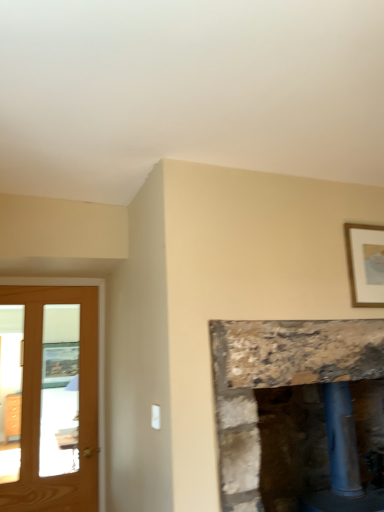
Question: From a real-world perspective, does gold wooden picture frame at upper right stand above rustic stone fireplace at center?

Choices:
 (A) yes
 (B) no

Answer: (A)

Question: From a real-world perspective, is gold wooden picture frame at upper right below rustic stone fireplace at center?

Choices:
 (A) no
 (B) yes

Answer: (A)

Question: Considering the relative positions of gold wooden picture frame at upper right and rustic stone fireplace at center in the image provided, is gold wooden picture frame at upper right to the left of rustic stone fireplace at center from the viewer's perspective?

Choices:
 (A) no
 (B) yes

Answer: (B)

Question: Can you confirm if gold wooden picture frame at upper right is bigger than rustic stone fireplace at center?

Choices:
 (A) no
 (B) yes

Answer: (A)

Question: Does gold wooden picture frame at upper right have a smaller size compared to rustic stone fireplace at center?

Choices:
 (A) no
 (B) yes

Answer: (B)

Question: Is gold wooden picture frame at upper right bigger or smaller than rustic stone fireplace at center?

Choices:
 (A) small
 (B) big

Answer: (A)

Question: Choose the correct answer: Is gold wooden picture frame at upper right inside rustic stone fireplace at center or outside it?

Choices:
 (A) inside
 (B) outside

Answer: (B)

Question: Does point (380, 244) appear closer or farther from the camera than point (251, 463)?

Choices:
 (A) closer
 (B) farther

Answer: (B)

Question: Is gold wooden picture frame at upper right taller or shorter than rustic stone fireplace at center?

Choices:
 (A) short
 (B) tall

Answer: (A)

Question: Which is correct: light brown wooden screen door at left is inside gold wooden picture frame at upper right, or outside of it?

Choices:
 (A) outside
 (B) inside

Answer: (A)

Question: Based on their positions, is light brown wooden screen door at left located to the left or right of gold wooden picture frame at upper right?

Choices:
 (A) left
 (B) right

Answer: (A)

Question: From the image's perspective, is light brown wooden screen door at left positioned above or below gold wooden picture frame at upper right?

Choices:
 (A) below
 (B) above

Answer: (A)

Question: In the image, is light brown wooden screen door at left positioned in front of or behind gold wooden picture frame at upper right?

Choices:
 (A) behind
 (B) front

Answer: (A)

Question: From the image's perspective, is rustic stone fireplace at center above or below light brown wooden screen door at left?

Choices:
 (A) above
 (B) below

Answer: (B)

Question: Based on their positions, is rustic stone fireplace at center located to the left or right of light brown wooden screen door at left?

Choices:
 (A) right
 (B) left

Answer: (A)